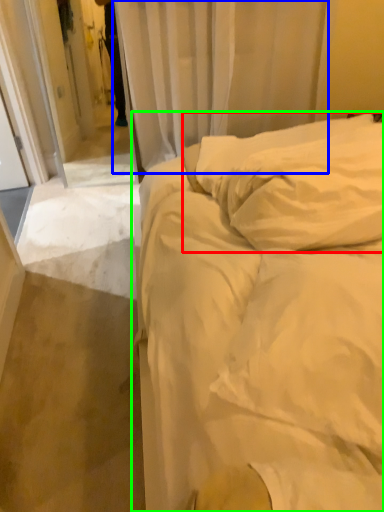
Question: Estimate the real-world distances between objects in this image. Which object is farther from pillow (highlighted by a red box), curtain (highlighted by a blue box) or bed (highlighted by a green box)?

Choices:
 (A) curtain
 (B) bed

Answer: (A)